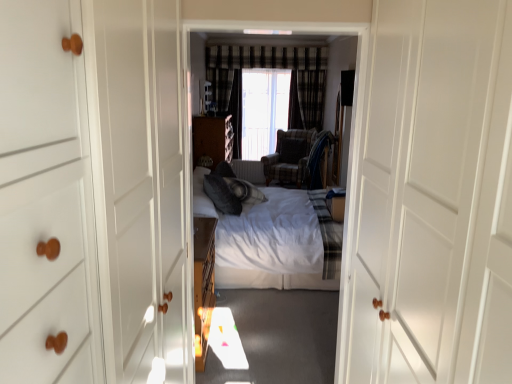
Where is `plaid fabric armchair at center`? plaid fabric armchair at center is located at coordinates (293, 156).

Find the location of a particular element. transparent plastic window screen at center is located at coordinates (263, 110).

Which object is closer to the camera taking this photo, white wood door at center or white soft bed at center?

white wood door at center.

Consider the image. Are white wood door at center and white soft bed at center located far from each other?

Yes, white wood door at center and white soft bed at center are located far from each other.

Which of these two, white wood door at center or white soft bed at center, stands shorter?

white soft bed at center is shorter.

Does white wood door at center have a larger size compared to white soft bed at center?

No.

What's the angular difference between white soft bed at center and plaid fabric curtain at center's facing directions?

white soft bed at center and plaid fabric curtain at center are facing 91 degrees away from each other.

Is white soft bed at center far from plaid fabric curtain at center?

white soft bed at center is far away from plaid fabric curtain at center.

Does point (278, 277) appear closer or farther from the camera than point (307, 110)?

Point (278, 277) is closer to the camera than point (307, 110).

Considering the relative sizes of white soft bed at center and white wood door at center in the image provided, is white soft bed at center taller than white wood door at center?

Indeed, white soft bed at center has a greater height compared to white wood door at center.

Looking at this image, is white soft bed at center wider or thinner than white wood door at center?

Clearly, white soft bed at center has less width compared to white wood door at center.

Is white soft bed at center oriented towards white wood door at center?

No.

Is white soft bed at center spatially inside white wood door at center, or outside of it?

white soft bed at center is outside white wood door at center.

Is transparent plastic window screen at center with plaid fabric curtain at center?

transparent plastic window screen at center and plaid fabric curtain at center are clearly separated.

Which object is positioned more to the right, transparent plastic window screen at center or plaid fabric curtain at center?

plaid fabric curtain at center is more to the right.

Is transparent plastic window screen at center not within plaid fabric curtain at center?

Yes, transparent plastic window screen at center is located beyond the bounds of plaid fabric curtain at center.

Is point (288, 96) positioned before point (307, 110)?

That is False.

Measure the distance between transparent plastic window screen at center and white soft bed at center.

8.78 feet.

Does transparent plastic window screen at center have a lesser width compared to white soft bed at center?

Yes.

Consider the image. Can white soft bed at center be found inside transparent plastic window screen at center?

No, transparent plastic window screen at center does not contain white soft bed at center.

Which is in front, transparent plastic window screen at center or white soft bed at center?

Positioned in front is white soft bed at center.

Find the location of a particular element. door to the right of matte brown cabinet at center is located at coordinates (434, 197).

Is white wood door at center inside or outside of matte brown cabinet at center?

white wood door at center is not enclosed by matte brown cabinet at center.

Considering the sizes of white wood door at center and matte brown cabinet at center in the image, is white wood door at center wider or thinner than matte brown cabinet at center?

In the image, white wood door at center appears to be wider than matte brown cabinet at center.

How distant is white wood door at center from matte brown cabinet at center?

The distance of white wood door at center from matte brown cabinet at center is 17.67 feet.

Does point (298, 177) come in front of point (385, 238)?

No, it is behind (385, 238).

Considering the sizes of objects plaid fabric armchair at center and white wood door at center in the image provided, who is bigger, plaid fabric armchair at center or white wood door at center?

white wood door at center is bigger.

In the scene shown: Do you think plaid fabric armchair at center is within white wood door at center, or outside of it?

plaid fabric armchair at center lies outside white wood door at center.

Is plaid fabric armchair at center to the right of white wood door at center from the viewer's perspective?

No, plaid fabric armchair at center is not to the right of white wood door at center.

There is a white soft bed at center. In order to click on door above it (from a real-world perspective) in this screenshot , I will do (x=434, y=197).

Image resolution: width=512 pixels, height=384 pixels. In order to click on bed below the plaid fabric curtain at center (from the image's perspective) in this screenshot , I will do `click(267, 241)`.

In the scene shown: Estimate the real-world distances between objects in this image. Which object is closer to plaid fabric armchair at center, white wood door at center or white soft bed at center?

white soft bed at center.

From the image, which object appears to be nearer to matte brown cabinet at center, white wood door at center or plaid fabric armchair at center?

plaid fabric armchair at center is closer to matte brown cabinet at center.

Considering their positions, is white wood door at center positioned closer to matte brown cabinet at center than transparent plastic window screen at center?

transparent plastic window screen at center.

When comparing their distances from plaid fabric curtain at center, does matte brown cabinet at center or white wood door at center seem closer?

matte brown cabinet at center lies closer to plaid fabric curtain at center than the other object.

Which object lies further to the anchor point transparent plastic window screen at center, white soft bed at center or white soft bed at center?

Among the two, white soft bed at center is located further to transparent plastic window screen at center.

When comparing their distances from white wood door at center, does plaid fabric curtain at center or transparent plastic window screen at center seem closer?

transparent plastic window screen at center is positioned closer to the anchor white wood door at center.

From the image, which object appears to be farther from plaid fabric armchair at center, plaid fabric curtain at center or white soft bed at center?

plaid fabric curtain at center.

In the scene shown: When comparing their distances from transparent plastic window screen at center, does white soft bed at center or matte brown cabinet at center seem closer?

matte brown cabinet at center is closer to transparent plastic window screen at center.

At what (x,y) coordinates should I click in order to perform the action: click on chair located between matte brown cabinet at center and plaid fabric curtain at center in the depth direction. Please return your answer as a coordinate pair (x, y). Looking at the image, I should click on (293, 156).

Where is `residence positioned between white wood door at center and plaid fabric curtain at center from near to far`? residence positioned between white wood door at center and plaid fabric curtain at center from near to far is located at coordinates (339, 69).

Locate an element on the screen. The image size is (512, 384). window screen between plaid fabric curtain at center and plaid fabric armchair at center in the vertical direction is located at coordinates (263, 110).

Where is `chair between white wood door at center and transparent plastic window screen at center from front to back`? Image resolution: width=512 pixels, height=384 pixels. chair between white wood door at center and transparent plastic window screen at center from front to back is located at coordinates (293, 156).